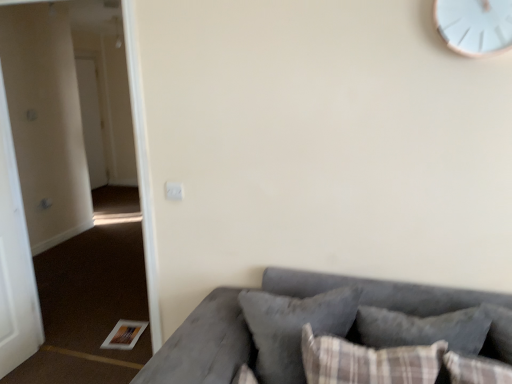
Question: Based on their sizes in the image, would you say white glossy door at left, placed as the first door when sorted from back to front, is bigger or smaller than white matte door at left, placed as the second door when sorted from back to front?

Choices:
 (A) small
 (B) big

Answer: (B)

Question: Based on their positions, is white glossy door at left, the second door positioned from the front, located to the left or right of white matte door at left, which is the second door from left to right?

Choices:
 (A) right
 (B) left

Answer: (B)

Question: Estimate the real-world distances between objects in this image. Which object is farther from the plaid fabric pillow at lower right, the first pillow from the front?

Choices:
 (A) white glossy door at left, positioned as the second door in right-to-left order
 (B) velvet gray pillow at lower center, marked as the 1th pillow in a back-to-front arrangement
 (C) velvet gray couch at lower right
 (D) white plastic clock at upper right
 (E) white matte door at left, the 1th door viewed from the right

Answer: (A)

Question: Which object is the closest to the brown carpet at lower left?

Choices:
 (A) plaid fabric pillow at lower right, the first pillow from the front
 (B) velvet gray pillow at lower center, marked as the 1th pillow in a back-to-front arrangement
 (C) white matte door at left, which is the second door from left to right
 (D) velvet gray couch at lower right
 (E) white glossy door at left, the second door positioned from the front

Answer: (C)